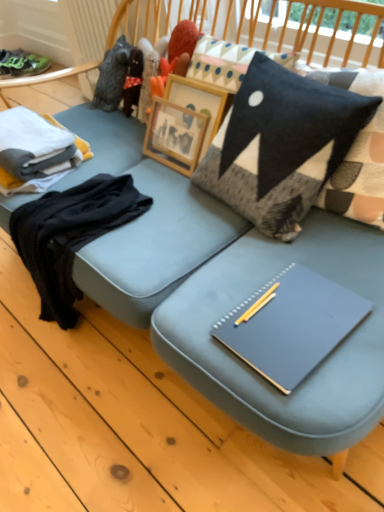
What do you see at coordinates (22, 63) in the screenshot?
I see `green suede sneakers at upper left` at bounding box center [22, 63].

Where is `black felt pillow at upper right`? black felt pillow at upper right is located at coordinates (280, 144).

From the image's perspective, starting from the matte gray notebook at center, which clothing is the 1st one above? Please provide its 2D coordinates.

[(70, 234)]

From the picture: Is black cotton sweater at left, which is the 2th clothing from top to bottom, completely or partially outside of matte gray notebook at center?

That's correct, black cotton sweater at left, which is the 2th clothing from top to bottom, is outside of matte gray notebook at center.

Considering the positions of point (29, 236) and point (222, 332), is point (29, 236) closer or farther from the camera than point (222, 332)?

Point (29, 236).

What's the angular difference between black cotton sweater at left, the first clothing positioned from the bottom, and matte gray notebook at center's facing directions?

The angle between the facing direction of black cotton sweater at left, the first clothing positioned from the bottom, and the facing direction of matte gray notebook at center is 1.73 degrees.

Considering the relative sizes of black felt pillow at upper right and white cotton folded clothes at left, which ranks as the 1th clothing in top-to-bottom order, in the image provided, is black felt pillow at upper right bigger than white cotton folded clothes at left, which ranks as the 1th clothing in top-to-bottom order,?

Correct, black felt pillow at upper right is larger in size than white cotton folded clothes at left, which ranks as the 1th clothing in top-to-bottom order.

Looking at this image, is black felt pillow at upper right located outside white cotton folded clothes at left, which ranks as the second clothing in bottom-to-top order?

black felt pillow at upper right lies outside white cotton folded clothes at left, which ranks as the second clothing in bottom-to-top order,'s area.

Between point (293, 191) and point (45, 182), which one is positioned in front?

The point (293, 191) is closer.

Considering their positions, is black felt pillow at upper right located in front of or behind white cotton folded clothes at left, which ranks as the second clothing in bottom-to-top order?

In the image, black felt pillow at upper right appears in front of white cotton folded clothes at left, which ranks as the second clothing in bottom-to-top order.

Can you confirm if black cotton sweater at left, the first clothing positioned from the bottom, is smaller than black felt pillow at upper right?

Correct, black cotton sweater at left, the first clothing positioned from the bottom, occupies less space than black felt pillow at upper right.

Would you say black cotton sweater at left, the first clothing positioned from the bottom, is to the left or to the right of black felt pillow at upper right in the picture?

Clearly, black cotton sweater at left, the first clothing positioned from the bottom, is on the left of black felt pillow at upper right in the image.

Which object is closer to the camera, black cotton sweater at left, the first clothing positioned from the bottom, or black felt pillow at upper right?

Positioned in front is black felt pillow at upper right.

Consider the image. From a real-world perspective, is black cotton sweater at left, the first clothing positioned from the bottom, physically below black felt pillow at upper right?

Yes, from a real-world perspective, black cotton sweater at left, the first clothing positioned from the bottom, is below black felt pillow at upper right.

Is the position of green suede sneakers at upper left more distant than that of matte gray notebook at center?

Yes, green suede sneakers at upper left is further from the viewer.

Does green suede sneakers at upper left have a smaller size compared to matte gray notebook at center?

No, green suede sneakers at upper left is not smaller than matte gray notebook at center.

Which is more to the right, green suede sneakers at upper left or matte gray notebook at center?

Positioned to the right is matte gray notebook at center.

Could you tell me if green suede sneakers at upper left is turned towards matte gray notebook at center?

No, green suede sneakers at upper left does not turn towards matte gray notebook at center.

From a real-world perspective, which is physically above, matte gray notebook at center or black felt pillow at upper right?

In real-world perspective, black felt pillow at upper right is above.

Is matte gray notebook at center far away from black felt pillow at upper right?

Actually, matte gray notebook at center and black felt pillow at upper right are a little close together.

Can you tell me how much matte gray notebook at center and black felt pillow at upper right differ in facing direction?

1.56 degrees.

Is matte gray notebook at center facing away from black felt pillow at upper right?

Yes, matte gray notebook at center is positioned with its back facing black felt pillow at upper right.

From the image's perspective, is white cotton folded clothes at left, which ranks as the 1th clothing in top-to-bottom order, below green suede sneakers at upper left?

Yes.

Are white cotton folded clothes at left, which ranks as the second clothing in bottom-to-top order, and green suede sneakers at upper left located far from each other?

Yes, white cotton folded clothes at left, which ranks as the second clothing in bottom-to-top order, and green suede sneakers at upper left are quite far apart.

Can you confirm if white cotton folded clothes at left, which ranks as the second clothing in bottom-to-top order, is thinner than green suede sneakers at upper left?

Yes, white cotton folded clothes at left, which ranks as the second clothing in bottom-to-top order, is thinner than green suede sneakers at upper left.

From their relative heights in the image, would you say white cotton folded clothes at left, which ranks as the second clothing in bottom-to-top order, is taller or shorter than green suede sneakers at upper left?

Clearly, white cotton folded clothes at left, which ranks as the second clothing in bottom-to-top order, is shorter compared to green suede sneakers at upper left.

Considering the positions of point (276, 342) and point (56, 141), is point (276, 342) closer or farther from the camera than point (56, 141)?

Point (276, 342) appears to be closer to the viewer than point (56, 141).

Consider the image. Is matte gray notebook at center surrounding white cotton folded clothes at left, which ranks as the second clothing in bottom-to-top order?

No, white cotton folded clothes at left, which ranks as the second clothing in bottom-to-top order, is not inside matte gray notebook at center.

From a real-world perspective, which object rests below the other?

matte gray notebook at center, from a real-world perspective.

Starting from the matte gray notebook at center, which clothing is the 1st one to the left? Please provide its 2D coordinates.

[(70, 234)]

Starting from the black felt pillow at upper right, which clothing is the 2nd one behind? Please provide its 2D coordinates.

[(36, 151)]

Estimate the real-world distances between objects in this image. Which object is further from matte gray notebook at center, white cotton folded clothes at left, which ranks as the 1th clothing in top-to-bottom order, or black felt pillow at upper right?

The object further to matte gray notebook at center is white cotton folded clothes at left, which ranks as the 1th clothing in top-to-bottom order.

Considering their positions, is black felt pillow at upper right positioned closer to white cotton folded clothes at left, which ranks as the second clothing in bottom-to-top order, than black cotton sweater at left, which is the 2th clothing from top to bottom?

black cotton sweater at left, which is the 2th clothing from top to bottom, lies closer to white cotton folded clothes at left, which ranks as the second clothing in bottom-to-top order, than the other object.

Considering their positions, is black felt pillow at upper right positioned closer to matte gray notebook at center than white cotton folded clothes at left, which ranks as the 1th clothing in top-to-bottom order?

black felt pillow at upper right.

Looking at the image, which one is located closer to black cotton sweater at left, which is the 2th clothing from top to bottom, black felt pillow at upper right or green suede sneakers at upper left?

black felt pillow at upper right is positioned closer to the anchor black cotton sweater at left, which is the 2th clothing from top to bottom.

Estimate the real-world distances between objects in this image. Which object is further from black felt pillow at upper right, green suede sneakers at upper left or black cotton sweater at left, which is the 2th clothing from top to bottom?

Based on the image, green suede sneakers at upper left appears to be further to black felt pillow at upper right.

From the picture: Which object lies further to the anchor point black felt pillow at upper right, black cotton sweater at left, which is the 2th clothing from top to bottom, or matte gray notebook at center?

Among the two, black cotton sweater at left, which is the 2th clothing from top to bottom, is located further to black felt pillow at upper right.

When comparing their distances from black felt pillow at upper right, does black cotton sweater at left, which is the 2th clothing from top to bottom, or white cotton folded clothes at left, which ranks as the second clothing in bottom-to-top order, seem further?

Based on the image, white cotton folded clothes at left, which ranks as the second clothing in bottom-to-top order, appears to be further to black felt pillow at upper right.

Looking at this image, considering their positions, is green suede sneakers at upper left positioned closer to matte gray notebook at center than black cotton sweater at left, the first clothing positioned from the bottom?

black cotton sweater at left, the first clothing positioned from the bottom, lies closer to matte gray notebook at center than the other object.

Image resolution: width=384 pixels, height=512 pixels. Find the location of `notebook between white cotton folded clothes at left, which ranks as the second clothing in bottom-to-top order, and black felt pillow at upper right from left to right`. notebook between white cotton folded clothes at left, which ranks as the second clothing in bottom-to-top order, and black felt pillow at upper right from left to right is located at coordinates (291, 325).

Locate an element on the screen. The image size is (384, 512). clothing between white cotton folded clothes at left, which ranks as the second clothing in bottom-to-top order, and black felt pillow at upper right is located at coordinates (70, 234).

In order to click on notebook situated between black cotton sweater at left, which is the 2th clothing from top to bottom, and black felt pillow at upper right from left to right in this screenshot , I will do `click(291, 325)`.

The height and width of the screenshot is (512, 384). I want to click on notebook located between black felt pillow at upper right and green suede sneakers at upper left in the depth direction, so click(291, 325).